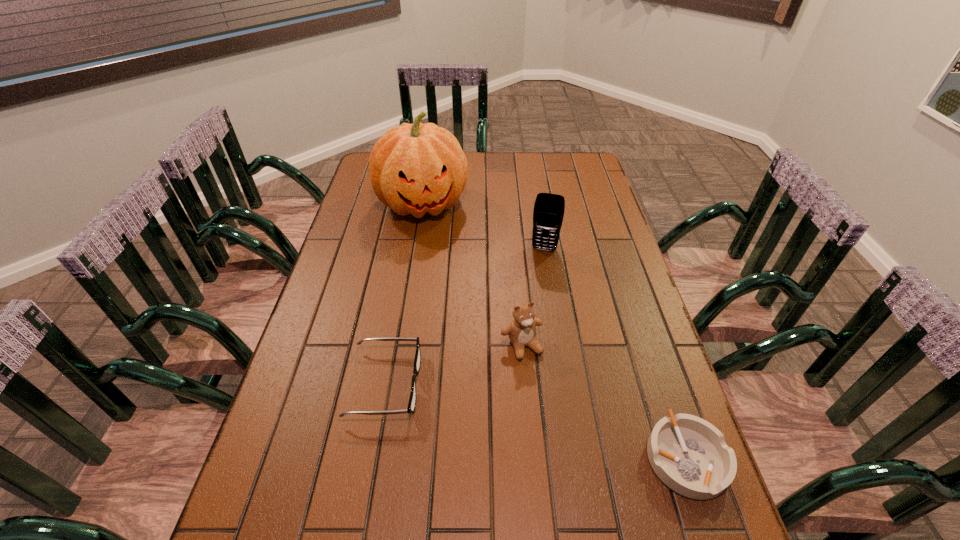
This screenshot has height=540, width=960. In order to click on object that is at the near edge in this screenshot , I will do `click(689, 455)`.

Image resolution: width=960 pixels, height=540 pixels. Find the location of `spectacles at the left edge`. spectacles at the left edge is located at coordinates (417, 361).

Find the location of a particular element. The height and width of the screenshot is (540, 960). pumpkin at the left edge is located at coordinates (416, 168).

Find the location of a particular element. This screenshot has width=960, height=540. object present at the right edge is located at coordinates (689, 455).

Find the location of a particular element. The image size is (960, 540). object that is at the far left corner is located at coordinates (416, 168).

Identify the location of object that is at the near right corner. The height and width of the screenshot is (540, 960). (689, 455).

Where is `vacant space at the far edge`? The height and width of the screenshot is (540, 960). vacant space at the far edge is located at coordinates (480, 175).

You are a GUI agent. You are given a task and a screenshot of the screen. Output one action in this format:
    pyautogui.click(x=<x>, y=<y>)
    Task: Click on the free space at the near edge of the desktop
    The width and height of the screenshot is (960, 540).
    Given the screenshot: What is the action you would take?
    pyautogui.click(x=397, y=508)

At what (x,y) coordinates should I click in order to perform the action: click on free region at the left edge of the desktop. Please return your answer as a coordinate pair (x, y). This screenshot has height=540, width=960. Looking at the image, I should click on (336, 362).

Where is `vacant area at the right edge of the desktop`? vacant area at the right edge of the desktop is located at coordinates (585, 269).